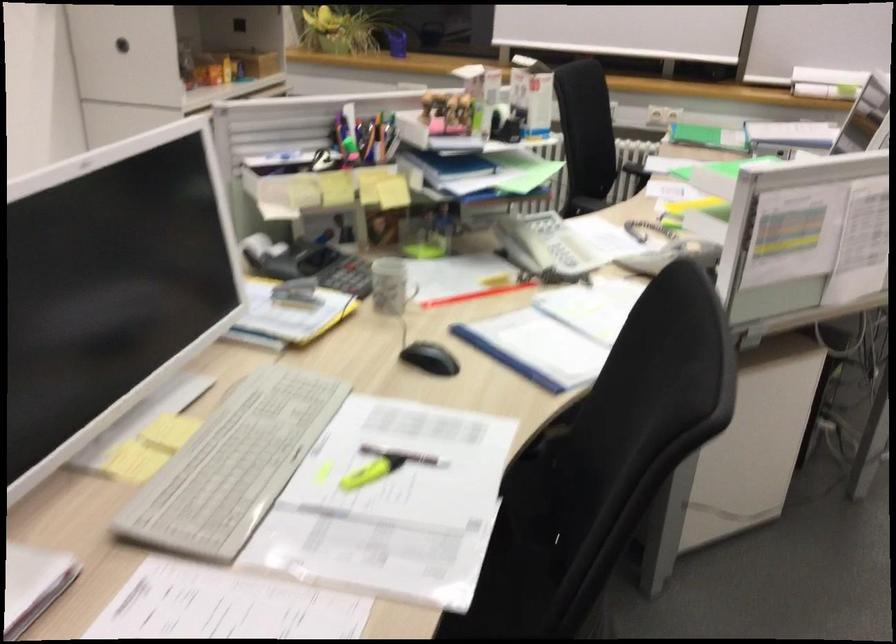
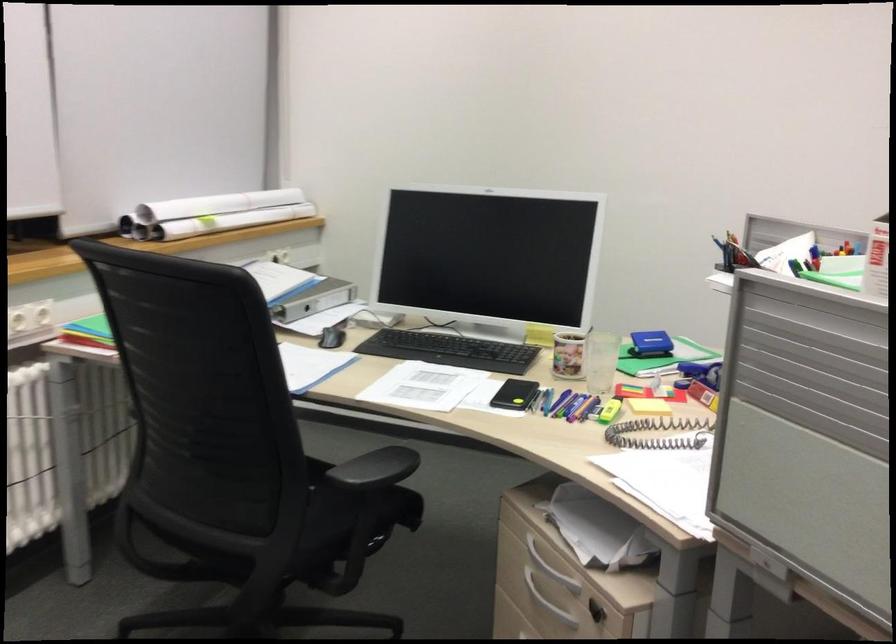
The point at (655, 216) is marked in the first image. Where is the corresponding point in the second image?

(609, 411)